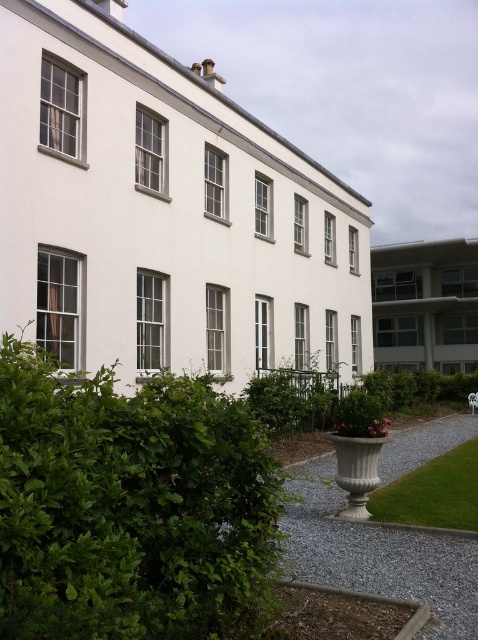
You are a gardener who needs to trim the green leafy hedge at lower left and the green grass at lower right. Which task will require more time due to the size of the plants?

The green leafy hedge at lower left will require more time to trim because it has a larger size compared to the green grass at lower right.

You are a gardener checking the layout of the garden. You see the green leafy hedge at lower left and the green grass at lower right. Which one is positioned to the left side of the other?

The green leafy hedge at lower left is positioned to the left of the green grass at lower right.